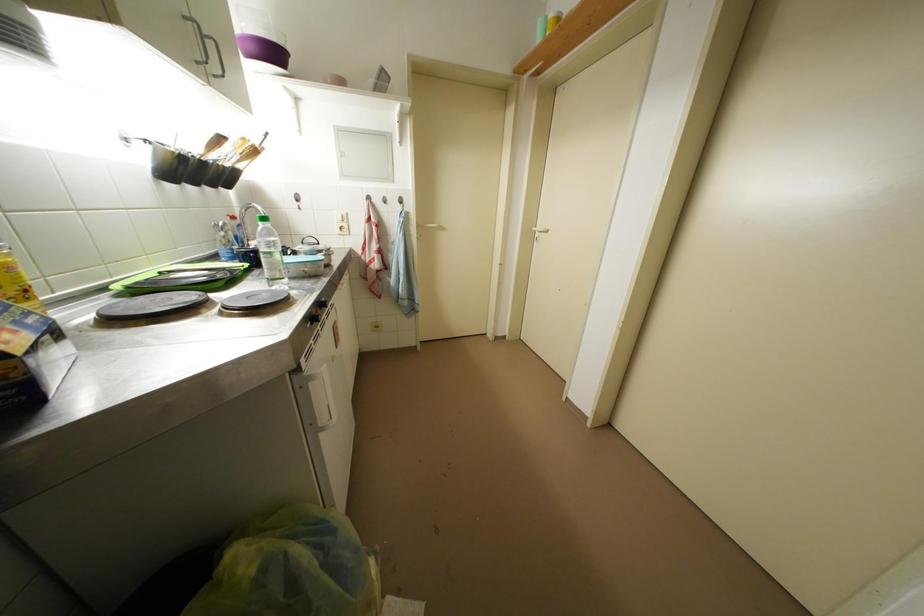
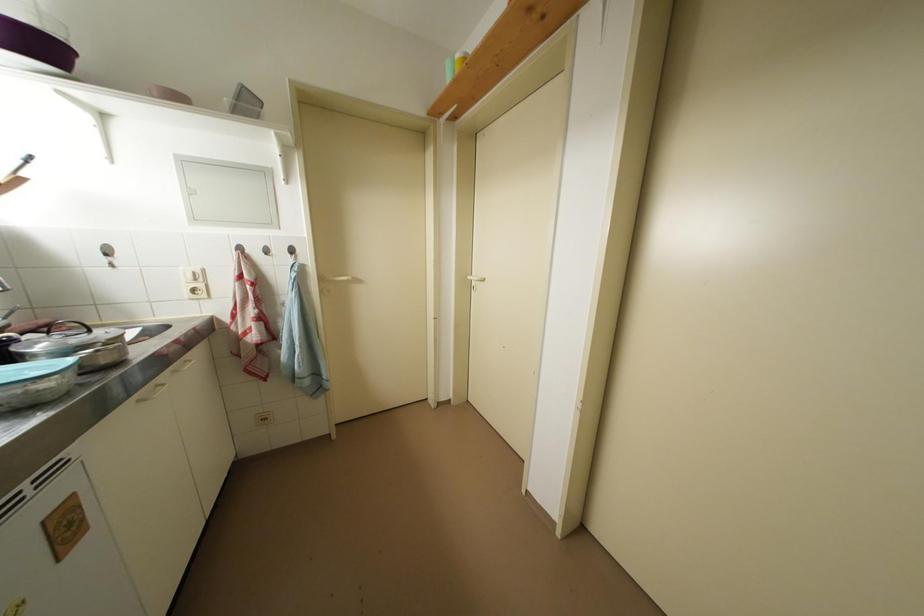
Question: How did the camera likely rotate?

Choices:
 (A) Left
 (B) Right
 (C) Up
 (D) Down

Answer: (B)